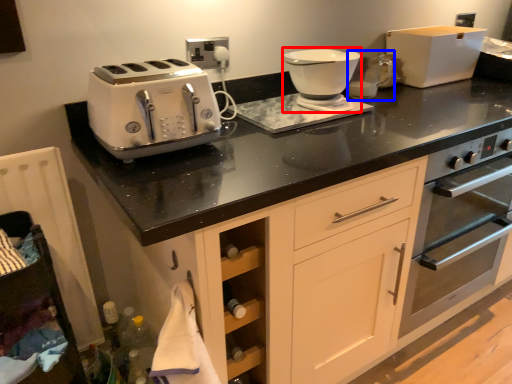
Question: Among these objects, which one is farthest to the camera, food processor (highlighted by a red box) or coffee machine (highlighted by a blue box)?

Choices:
 (A) food processor
 (B) coffee machine

Answer: (B)